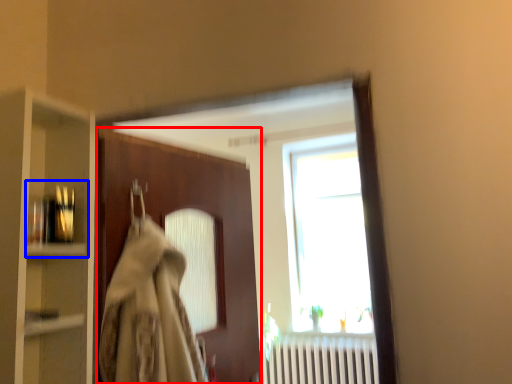
Question: Which point is closer to the camera, door (highlighted by a red box) or shelf (highlighted by a blue box)?

Choices:
 (A) door
 (B) shelf

Answer: (B)